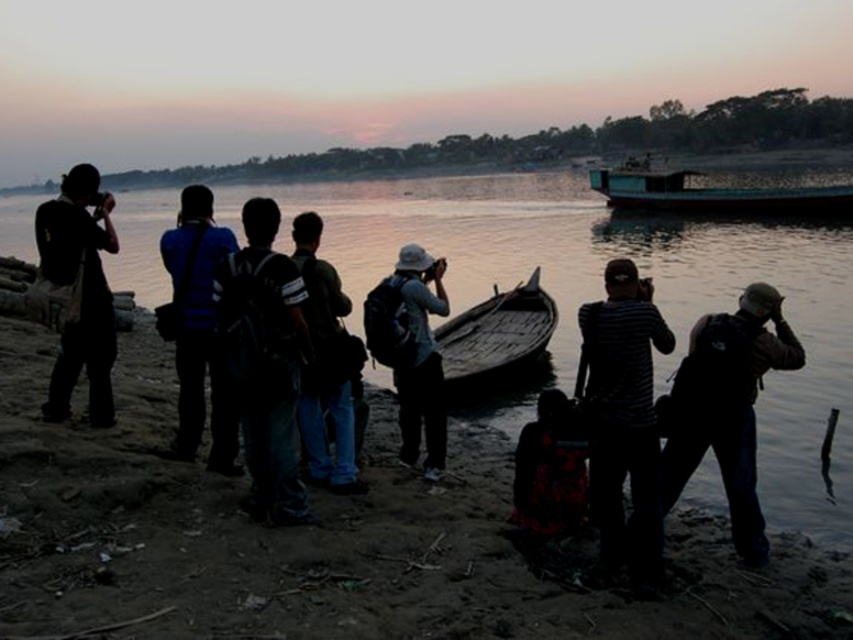
Measure the distance between dark brown backpack at right and camera.

dark brown backpack at right is 6.82 meters away from camera.

Which of these two, dark brown backpack at right or denim jeans at center, stands taller?

With more height is dark brown backpack at right.

Is point (753, 376) positioned behind point (341, 412)?

No, (753, 376) is in front of (341, 412).

You are a GUI agent. You are given a task and a screenshot of the screen. Output one action in this format:
    pyautogui.click(x=<x>, y=<y>)
    Task: Click on the dark brown backpack at right
    This screenshot has width=853, height=640.
    Given the screenshot: What is the action you would take?
    pyautogui.click(x=727, y=406)

Who is more distant from viewer, [79,355] or [526,301]?

The point [526,301] is more distant.

Can you confirm if matte black backpack at left is positioned to the left of wooden canoe at center?

Indeed, matte black backpack at left is positioned on the left side of wooden canoe at center.

Does point (102, 413) come closer to viewer compared to point (531, 332)?

Yes, point (102, 413) is closer to viewer.

Where is `matte black backpack at left`? The image size is (853, 640). matte black backpack at left is located at coordinates (80, 291).

Who is higher up, wooden canoe at center or floral fabric dress at center?

wooden canoe at center

Is point (492, 344) positioned before point (529, 522)?

No.

Where is `wooden canoe at center`? The width and height of the screenshot is (853, 640). wooden canoe at center is located at coordinates (496, 337).

Find the location of a particular element. wooden canoe at center is located at coordinates (496, 337).